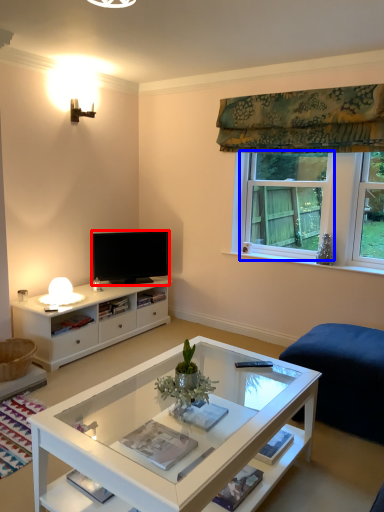
Question: Which object is further to the camera taking this photo, television (highlighted by a red box) or window (highlighted by a blue box)?

Choices:
 (A) television
 (B) window

Answer: (A)